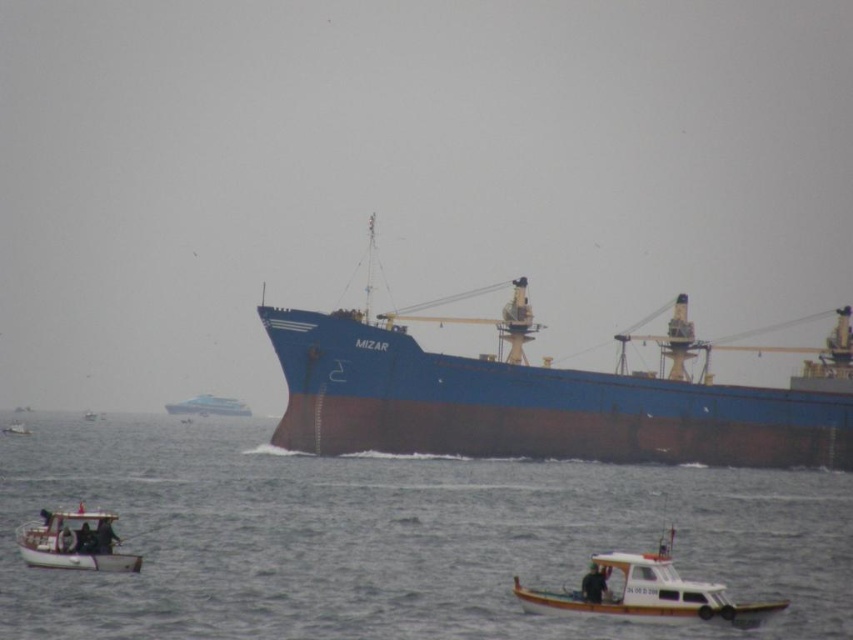
Is blue matte cargo ship at center to the right of white plastic boat at lower right from the viewer's perspective?

No, blue matte cargo ship at center is not to the right of white plastic boat at lower right.

Which is more to the right, blue matte cargo ship at center or white plastic boat at lower right?

white plastic boat at lower right is more to the right.

Is point (469, 397) farther from camera compared to point (650, 579)?

Yes.

The image size is (853, 640). Identify the location of blue matte cargo ship at center. pos(548,394).

Between blue matte cargo ship at center and white wooden boat at lower left, which one is positioned lower?

Positioned lower is white wooden boat at lower left.

Is point (531, 308) farther from camera compared to point (131, 566)?

Yes, point (531, 308) is farther from viewer.

Identify the location of blue matte cargo ship at center. (548, 394).

Is point (357, 408) farther from viewer compared to point (3, 432)?

No.

Is point (463, 392) less distant than point (24, 433)?

Yes, point (463, 392) is closer to viewer.

Find the location of a particular element. This screenshot has width=853, height=640. blue matte cargo ship at center is located at coordinates (548, 394).